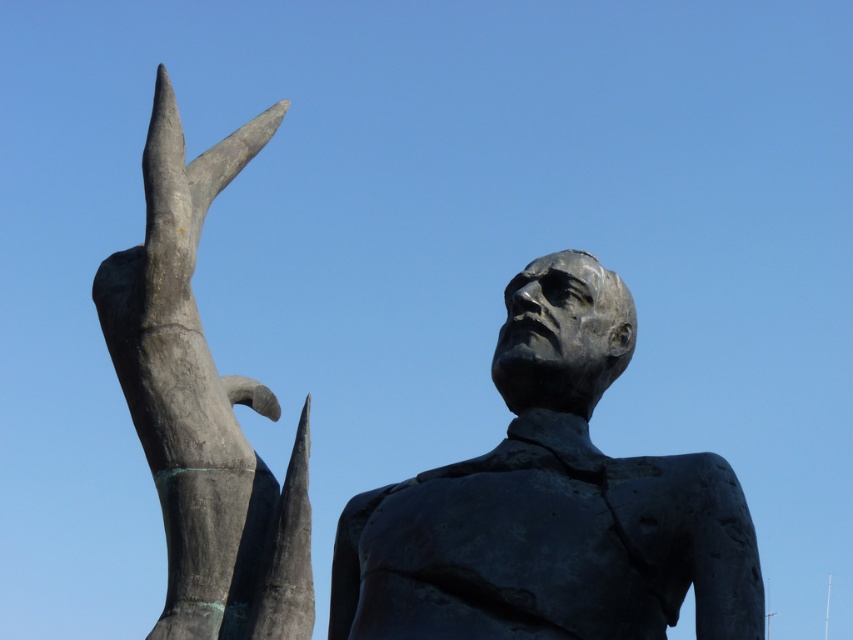
Does bronze statue at upper center appear over bronze hand at upper left?

No.

Can you confirm if bronze statue at upper center is shorter than bronze hand at upper left?

Correct, bronze statue at upper center is not as tall as bronze hand at upper left.

The width and height of the screenshot is (853, 640). Describe the element at coordinates (550, 504) in the screenshot. I see `bronze statue at upper center` at that location.

Identify the location of bronze statue at upper center. Image resolution: width=853 pixels, height=640 pixels. (550, 504).

Does bronze statue at center appear on the left side of bronze hand at upper left?

In fact, bronze statue at center is to the right of bronze hand at upper left.

Can you confirm if bronze statue at center is taller than bronze hand at upper left?

Incorrect, bronze statue at center's height is not larger of bronze hand at upper left's.

Between point (729, 552) and point (164, 634), which one is positioned behind?

The point (164, 634) is behind.

Find the location of a particular element. bronze statue at center is located at coordinates (550, 502).

Which is in front, point (387, 561) or point (706, 589)?

Point (706, 589) is in front.

Who is more distant from viewer, (506, 333) or (537, 323)?

The point (506, 333) is behind.

Find the location of a particular element. The height and width of the screenshot is (640, 853). bronze statue at upper center is located at coordinates (550, 504).

Find the location of a particular element. bronze statue at upper center is located at coordinates (550, 504).